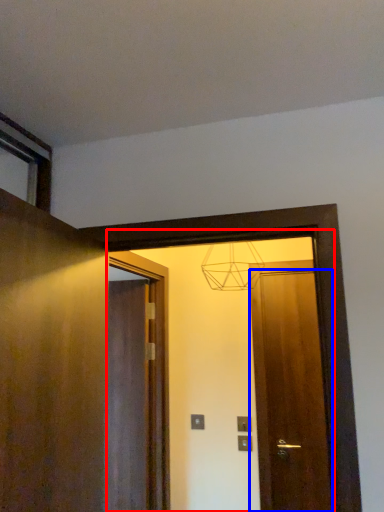
Question: Which object is further to the camera taking this photo, mirror (highlighted by a red box) or door (highlighted by a blue box)?

Choices:
 (A) mirror
 (B) door

Answer: (B)